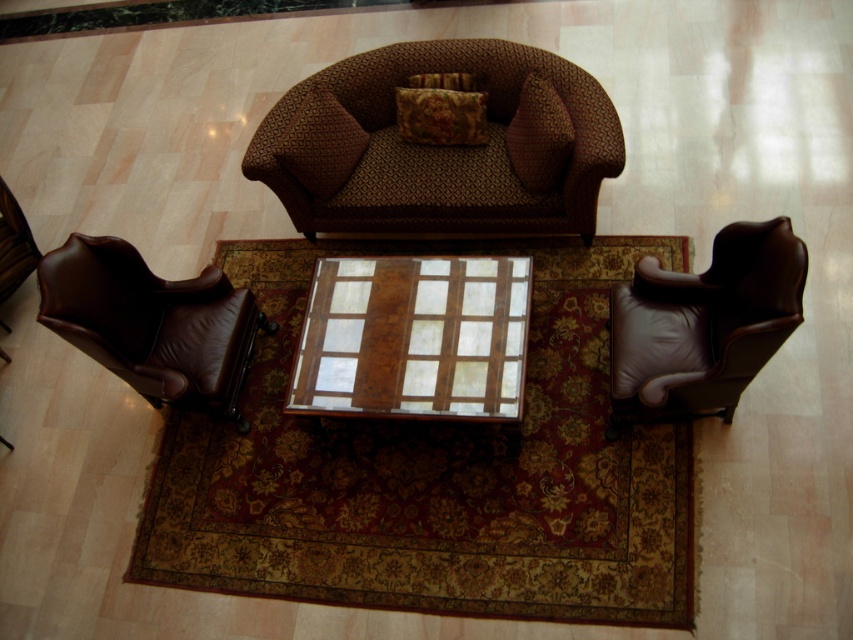
Question: Which object is farther from the camera taking this photo?

Choices:
 (A) velvet cushion at center
 (B) floral fabric pillow at center
 (C) brown leather armchair at left

Answer: (B)

Question: Does velvet cushion at center have a greater width compared to floral fabric pillow at center?

Choices:
 (A) yes
 (B) no

Answer: (B)

Question: Which of these objects is positioned closest to the wooden/marble table at center?

Choices:
 (A) brown leather armchair at left
 (B) velvet cushion at center
 (C) brown textured couch at center

Answer: (C)

Question: Which point is closer to the camera taking this photo?

Choices:
 (A) (527, 132)
 (B) (373, 316)
 (C) (614, 426)
 (D) (503, 156)

Answer: (C)

Question: Is brown textured couch at center above wooden/marble table at center?

Choices:
 (A) yes
 (B) no

Answer: (A)

Question: Can you confirm if wooden/marble table at center is positioned above floral fabric pillow at center?

Choices:
 (A) no
 (B) yes

Answer: (A)